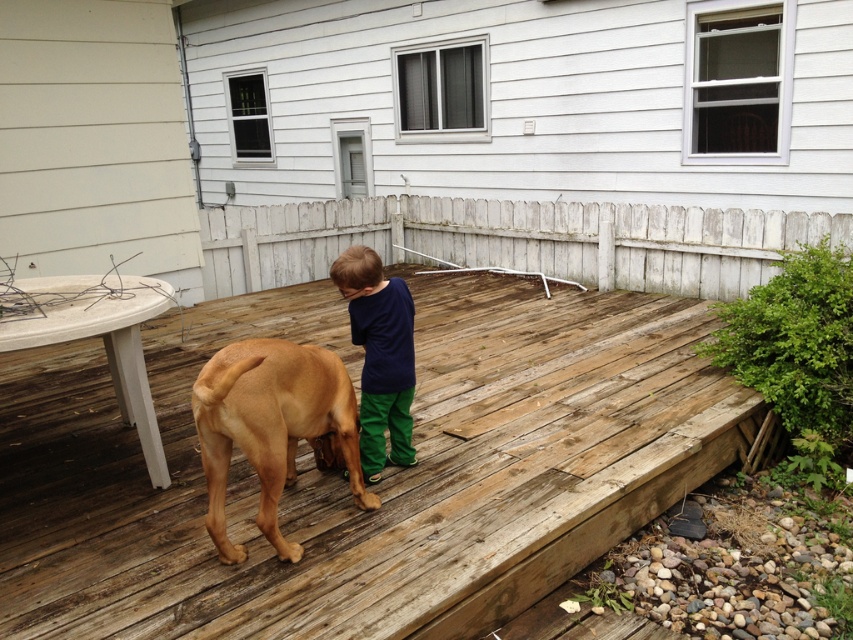
Question: Can you confirm if brown smooth dog at center is positioned below dark blue cotton shirt at center?

Choices:
 (A) no
 (B) yes

Answer: (B)

Question: Does weathered wood deck at center have a larger size compared to brown smooth dog at center?

Choices:
 (A) yes
 (B) no

Answer: (A)

Question: Based on their relative distances, which object is nearer to the dark blue cotton shirt at center?

Choices:
 (A) brown smooth dog at center
 (B) weathered wood deck at center

Answer: (A)

Question: Which of the following is the closest to the observer?

Choices:
 (A) (444, 513)
 (B) (390, 356)
 (C) (312, 353)

Answer: (C)

Question: Which point is closer to the camera?

Choices:
 (A) (218, 477)
 (B) (375, 355)
 (C) (573, 500)

Answer: (A)

Question: Is weathered wood deck at center above brown smooth dog at center?

Choices:
 (A) yes
 (B) no

Answer: (B)